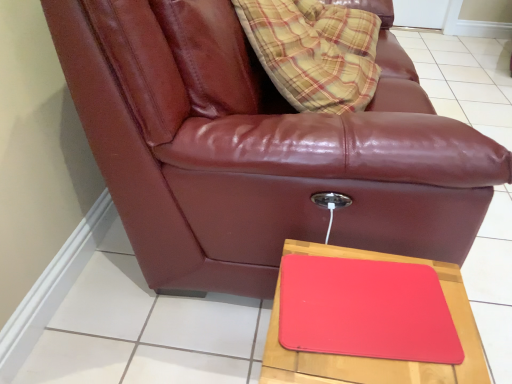
What are the coordinates of `blank space above rubberized red tray at lower right (from a real-world perspective)` in the screenshot? It's located at (384, 313).